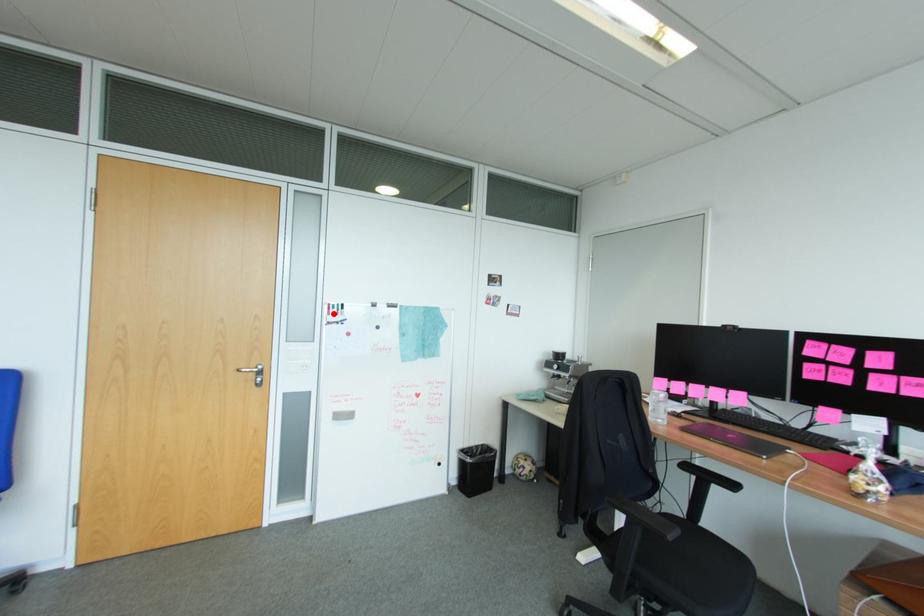
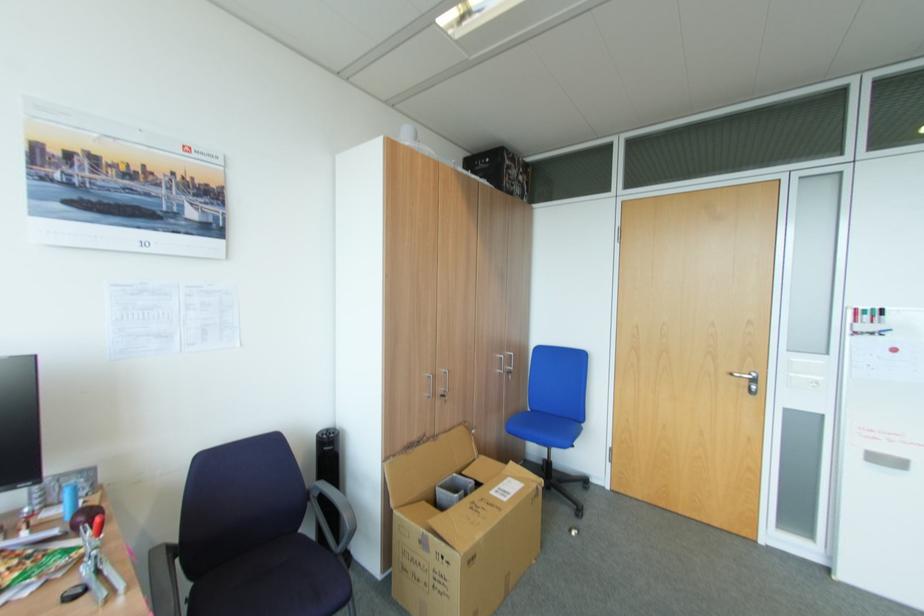
Locate, in the second image, the point that corresponds to the highlighted location in the first image.

(861, 322)